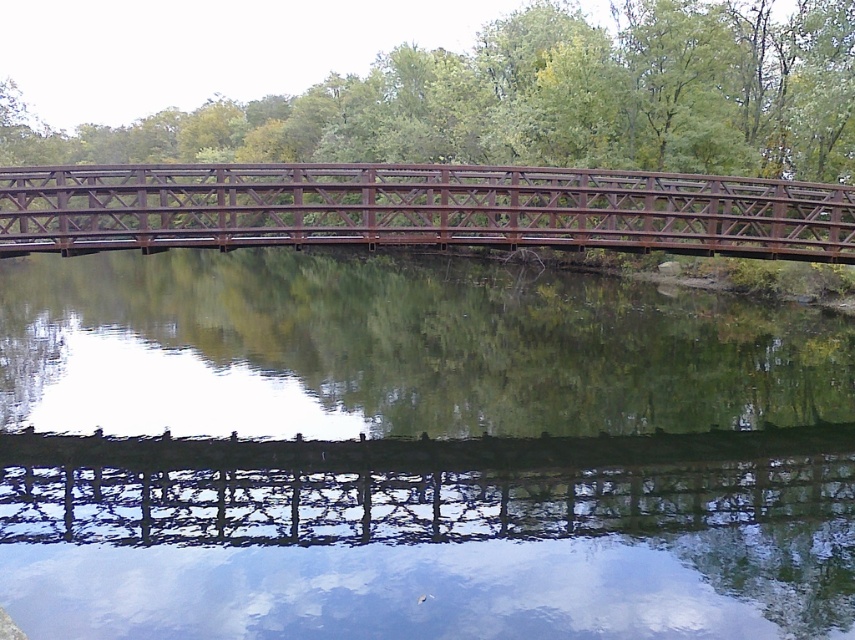
Question: Which object appears closest to the camera in this image?

Choices:
 (A) rusty metal bridge at center
 (B) green reflective water at center

Answer: (B)

Question: Among these points, which one is farthest from the camera?

Choices:
 (A) (201, 241)
 (B) (46, 564)

Answer: (A)

Question: Is green reflective water at center above rusty metal bridge at center?

Choices:
 (A) yes
 (B) no

Answer: (B)

Question: Is green reflective water at center bigger than rusty metal bridge at center?

Choices:
 (A) yes
 (B) no

Answer: (B)

Question: Can you confirm if green reflective water at center is bigger than rusty metal bridge at center?

Choices:
 (A) no
 (B) yes

Answer: (A)